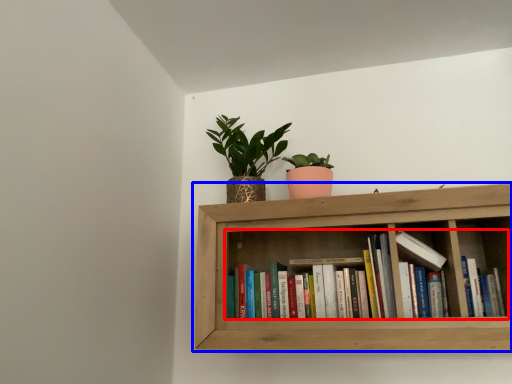
Question: Which point is further to the camera, book (highlighted by a red box) or shelf (highlighted by a blue box)?

Choices:
 (A) book
 (B) shelf

Answer: (A)